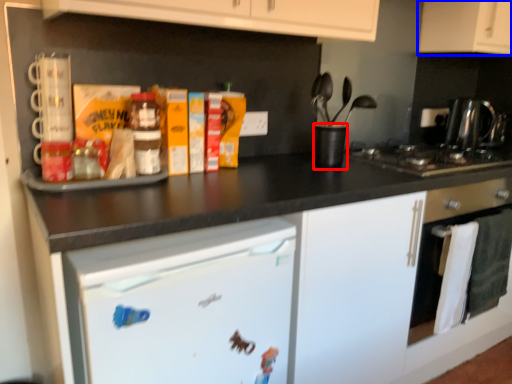
Question: Which of the following is the closest to the observer, appliance (highlighted by a red box) or cabinetry (highlighted by a blue box)?

Choices:
 (A) appliance
 (B) cabinetry

Answer: (A)